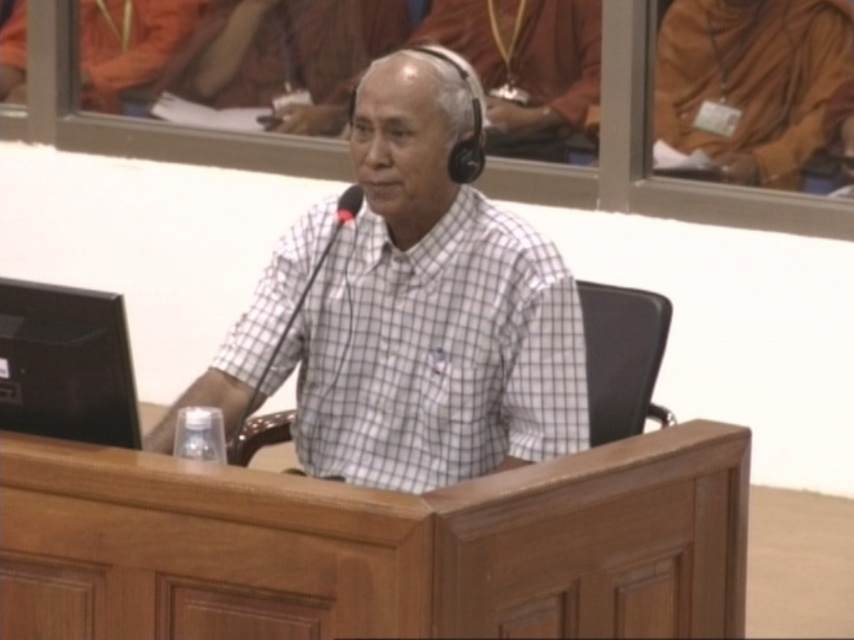
Question: Among these objects, which one is farthest from the camera?

Choices:
 (A) brown clothed monk at upper right
 (B) black leather chair at center
 (C) white checkered shirt at center
 (D) black glossy laptop at left

Answer: (A)

Question: Which is nearer to the brown clothed monk at upper right?

Choices:
 (A) white checkered shirt at center
 (B) black glossy laptop at left

Answer: (A)

Question: Is brown clothed monk at upper right smaller than black glossy laptop at left?

Choices:
 (A) no
 (B) yes

Answer: (A)

Question: Is black glossy laptop at left below black leather chair at center?

Choices:
 (A) no
 (B) yes

Answer: (A)

Question: Does wooden table at center appear on the right side of brown clothed monk at upper right?

Choices:
 (A) yes
 (B) no

Answer: (B)

Question: Which point is closer to the camera taking this photo?

Choices:
 (A) (624, 308)
 (B) (746, 132)
 (C) (56, 404)

Answer: (C)